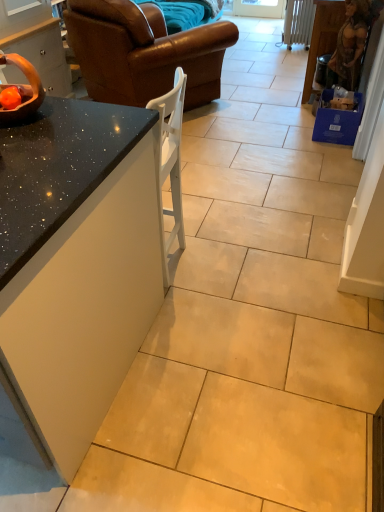
Question: Is matte black bowl at left, which appears as the 1th cabinetry when viewed from the left, bigger than wooden bowl at upper left?

Choices:
 (A) no
 (B) yes

Answer: (B)

Question: From the image's perspective, is matte black bowl at left, which appears as the 1th cabinetry when viewed from the left, below wooden bowl at upper left?

Choices:
 (A) yes
 (B) no

Answer: (B)

Question: From a real-world perspective, is matte black bowl at left, which appears as the 1th cabinetry when viewed from the left, physically below wooden bowl at upper left?

Choices:
 (A) no
 (B) yes

Answer: (B)

Question: Does matte black bowl at left, which appears as the 1th cabinetry when viewed from the left, have a lesser width compared to wooden bowl at upper left?

Choices:
 (A) yes
 (B) no

Answer: (B)

Question: Is matte black bowl at left, which is counted as the second cabinetry, starting from the right, looking in the opposite direction of wooden bowl at upper left?

Choices:
 (A) yes
 (B) no

Answer: (B)

Question: Is wooden bowl at upper left situated inside brown leather couch at upper left or outside?

Choices:
 (A) inside
 (B) outside

Answer: (B)

Question: In terms of width, does wooden bowl at upper left look wider or thinner when compared to brown leather couch at upper left?

Choices:
 (A) wide
 (B) thin

Answer: (B)

Question: From their relative heights in the image, would you say wooden bowl at upper left is taller or shorter than brown leather couch at upper left?

Choices:
 (A) short
 (B) tall

Answer: (A)

Question: In terms of size, does wooden bowl at upper left appear bigger or smaller than brown leather couch at upper left?

Choices:
 (A) big
 (B) small

Answer: (B)

Question: Considering the positions of point (41, 226) and point (23, 69), is point (41, 226) closer or farther from the camera than point (23, 69)?

Choices:
 (A) farther
 (B) closer

Answer: (B)

Question: Is speckled granite countertop at center-left, placed as the first countertop when sorted from right to left, inside the boundaries of wooden bowl at upper left, or outside?

Choices:
 (A) outside
 (B) inside

Answer: (A)

Question: Is speckled granite countertop at center-left, placed as the first countertop when sorted from right to left, wider or thinner than wooden bowl at upper left?

Choices:
 (A) wide
 (B) thin

Answer: (A)

Question: From the image's perspective, is speckled granite countertop at center-left, placed as the 2th countertop when sorted from left to right, positioned above or below wooden bowl at upper left?

Choices:
 (A) below
 (B) above

Answer: (A)

Question: Considering the positions of black granite countertop at left, the first countertop in the left-to-right sequence, and wooden statue at right, acting as the 2th cabinetry starting from the left, in the image, is black granite countertop at left, the first countertop in the left-to-right sequence, bigger or smaller than wooden statue at right, acting as the 2th cabinetry starting from the left,?

Choices:
 (A) big
 (B) small

Answer: (A)

Question: Considering the positions of black granite countertop at left, the first countertop in the left-to-right sequence, and wooden statue at right, the 1th cabinetry in the right-to-left sequence, in the image, is black granite countertop at left, the first countertop in the left-to-right sequence, taller or shorter than wooden statue at right, the 1th cabinetry in the right-to-left sequence,?

Choices:
 (A) short
 (B) tall

Answer: (B)